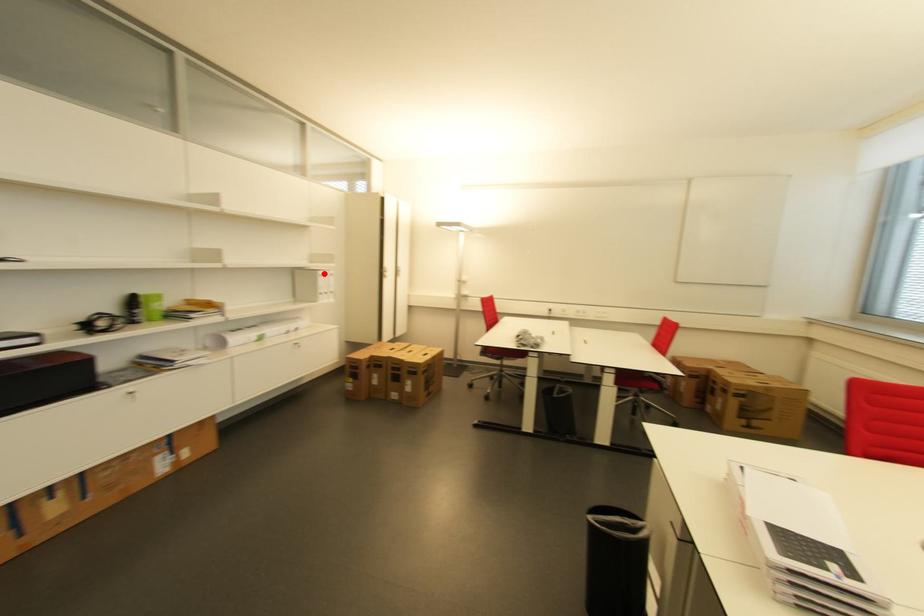
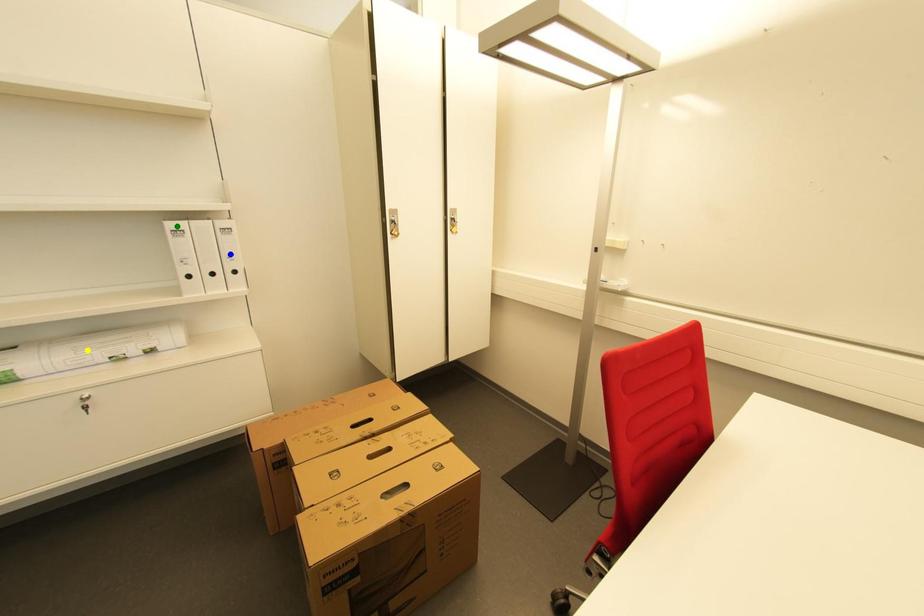
Question: I am providing you with two images of the same scene from different viewpoints. A red point is marked on the first image. You are given multiple points on the second image. Which mark in image 2 goes with the point in image 1?

Choices:
 (A) yellow point
 (B) green point
 (C) blue point

Answer: (B)